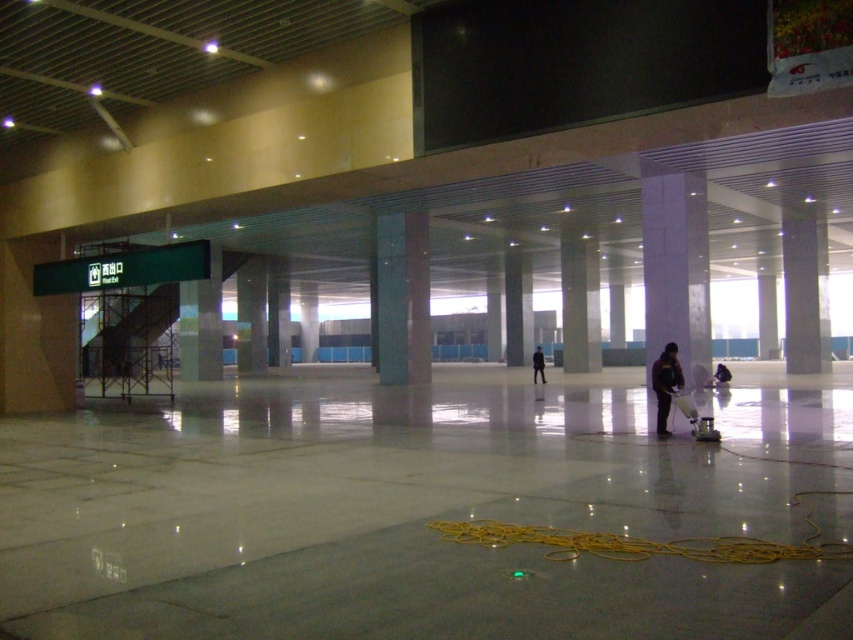
Is dark blue uniform at center closer to the viewer compared to black matte jacket at center?

Yes, dark blue uniform at center is in front of black matte jacket at center.

Does dark blue uniform at center have a greater width compared to black matte jacket at center?

Incorrect, dark blue uniform at center's width does not surpass black matte jacket at center's.

Is point (665, 404) positioned before point (543, 378)?

Yes, point (665, 404) is closer to viewer.

Locate an element on the screen. dark blue uniform at center is located at coordinates (665, 384).